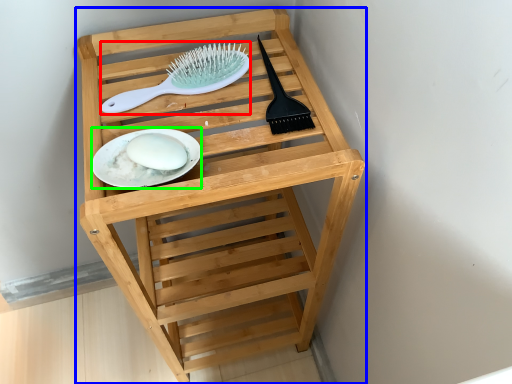
Question: Estimate the real-world distances between objects in this image. Which object is farther from brush (highlighted by a red box), furniture (highlighted by a blue box) or plate (highlighted by a green box)?

Choices:
 (A) furniture
 (B) plate

Answer: (A)